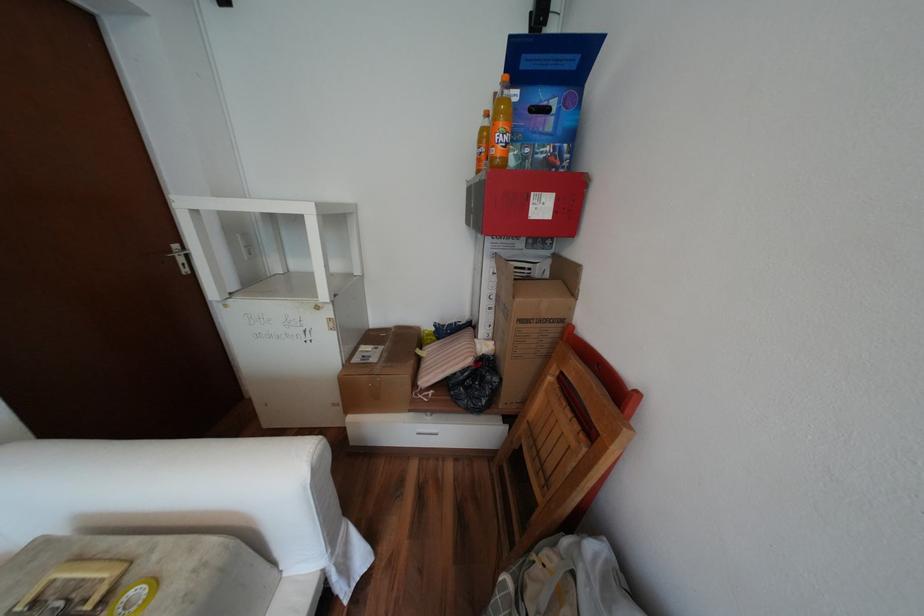
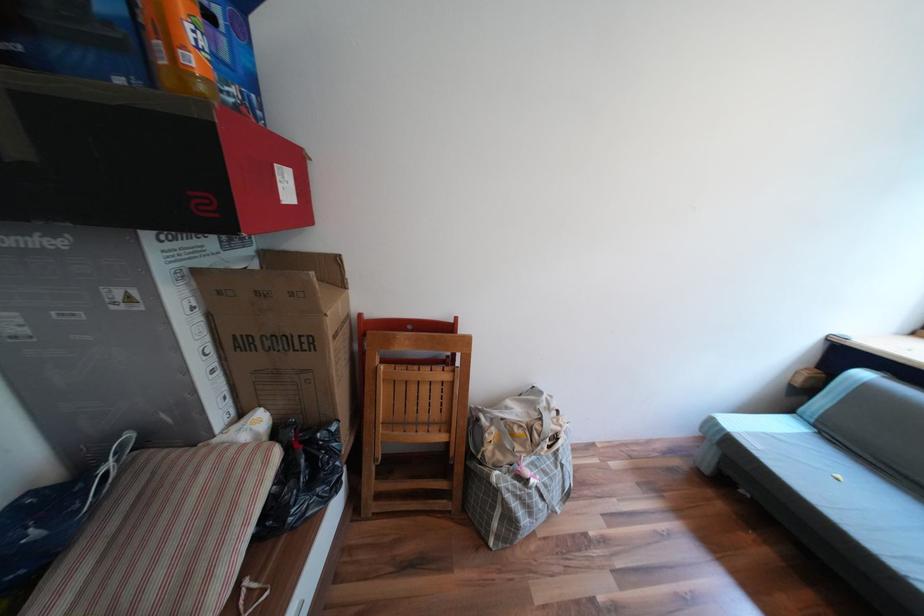
In the second image, find the point that corresponds to [472,354] in the first image.

(258, 464)